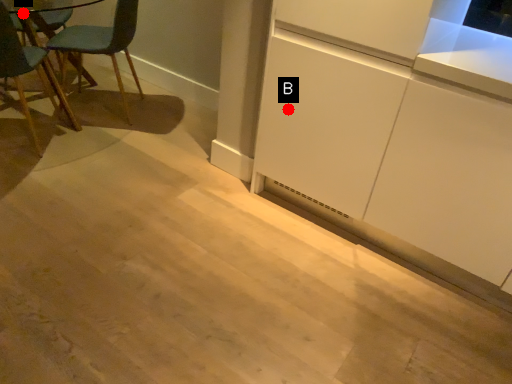
Question: Two points are circled on the image, labeled by A and B beside each circle. Which point is farther from the camera taking this photo?

Choices:
 (A) A is further
 (B) B is further

Answer: (A)